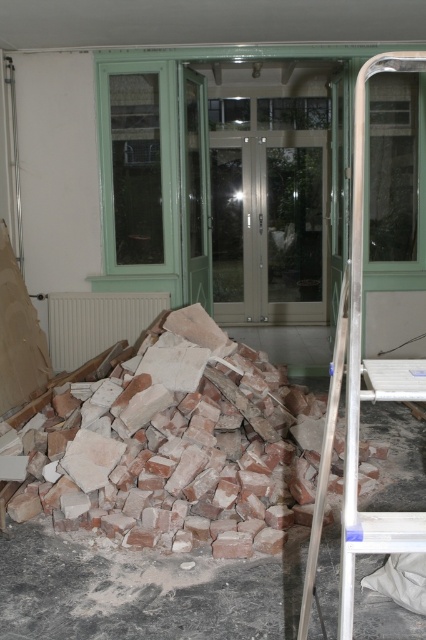
Consider the image. You are a construction worker carrying a heavy tool and need to move from the silver metallic ladder at right to the brick rubble at lower left. Considering the distance between them, can you safely walk straight from the ladder to the rubble without needing to detour around any obstacles?

The brick rubble at lower left is 5.67 feet away from the silver metallic ladder at right. Since the distance is manageable and there are no mentioned obstacles in the scene description, you can safely walk straight from the ladder to the rubble.

You are a contractor assessing the safety of the clear glass door at center and the silver metallic ladder at right in the room. Which object is taller?

The clear glass door at center is taller than the silver metallic ladder at right.

You are standing in the middle of the room and see two points marked on the floor. The first point is at coordinates point (247, 474) and the second is at point (262, 156). Which point is closer to you?

Point (247, 474) is in front of point (262, 156), so it is closer to you.